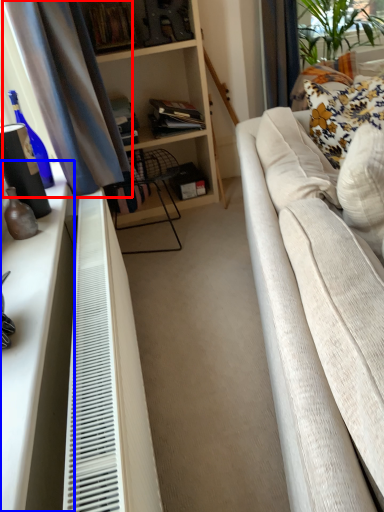
Question: Which point is further to the camera, curtain (highlighted by a red box) or dresser (highlighted by a blue box)?

Choices:
 (A) curtain
 (B) dresser

Answer: (A)